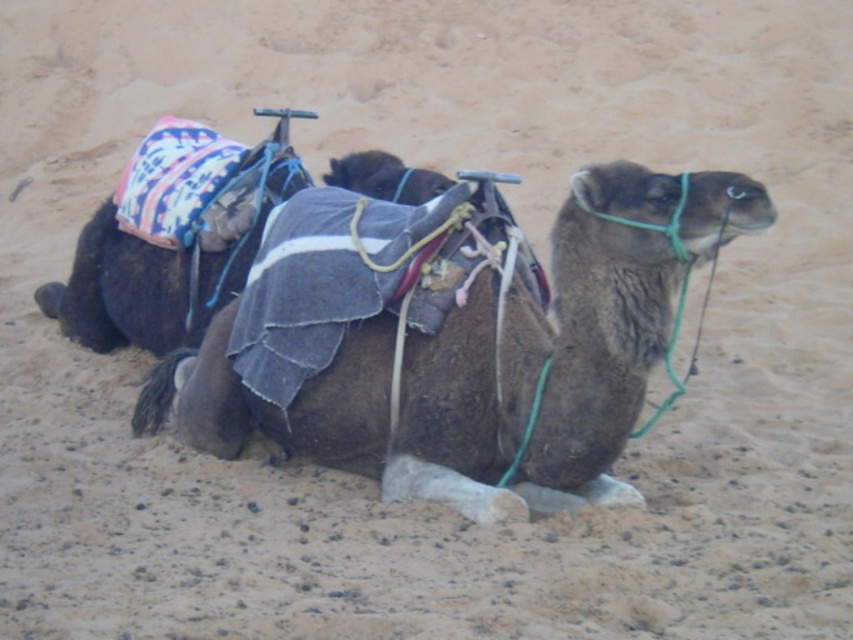
Who is lower down, brown fabric camel at center or dark brown fabric camel at center?

brown fabric camel at center is below.

Does brown fabric camel at center have a lesser height compared to dark brown fabric camel at center?

In fact, brown fabric camel at center may be taller than dark brown fabric camel at center.

Locate an element on the screen. brown fabric camel at center is located at coordinates (454, 337).